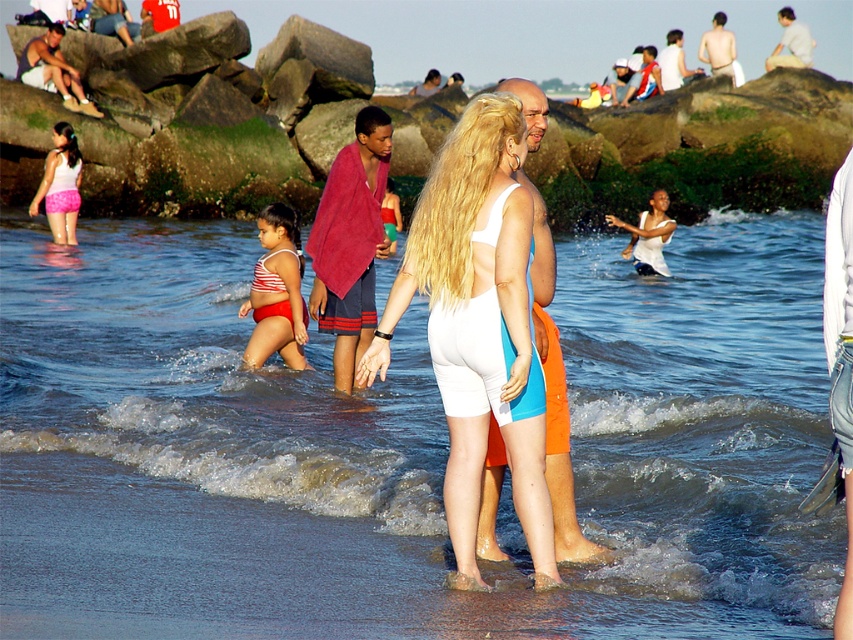
Question: Among these objects, which one is farthest from the camera?

Choices:
 (A) white matte swimsuit at center
 (B) striped fabric swimsuit at center
 (C) clear blue water at center
 (D) pink fabric shorts at left

Answer: (D)

Question: Is clear blue water at center smaller than pink fabric shorts at left?

Choices:
 (A) no
 (B) yes

Answer: (A)

Question: Can you confirm if white matte swimsuit at center is smaller than pink fabric shorts at left?

Choices:
 (A) yes
 (B) no

Answer: (B)

Question: Estimate the real-world distances between objects in this image. Which object is closer to the pink fabric shorts at left?

Choices:
 (A) white matte swimsuit at center
 (B) clear blue water at center

Answer: (B)

Question: Which of the following is the closest to the observer?

Choices:
 (A) clear blue water at center
 (B) pink fabric shorts at left
 (C) white matte swimsuit at center
 (D) striped fabric swimsuit at center

Answer: (A)

Question: Does striped fabric swimsuit at center have a larger size compared to pink fabric shorts at left?

Choices:
 (A) yes
 (B) no

Answer: (B)